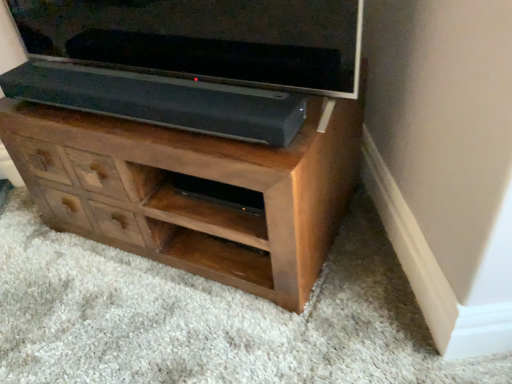
Identify the location of free point in front of brown wood chest of drawers at center. This screenshot has width=512, height=384. (204, 330).